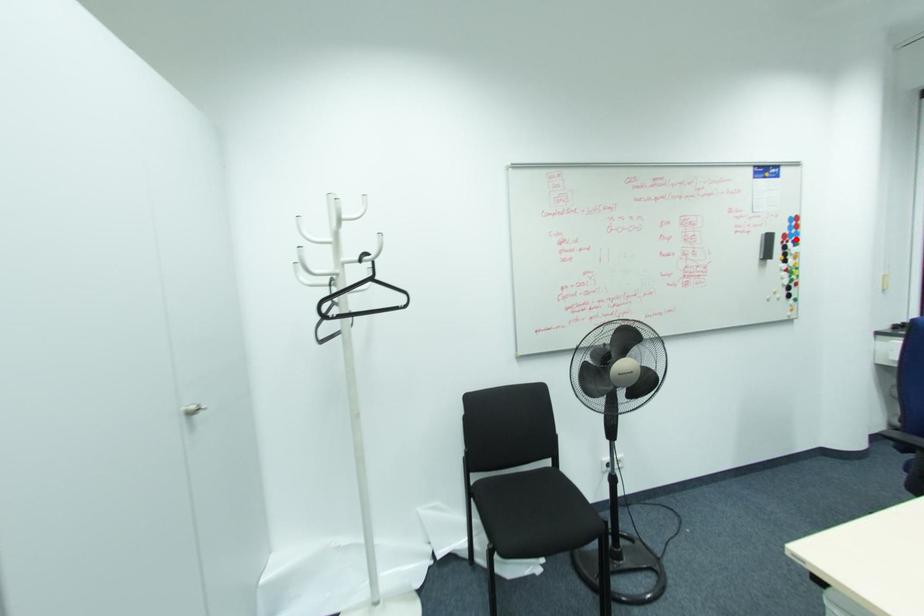
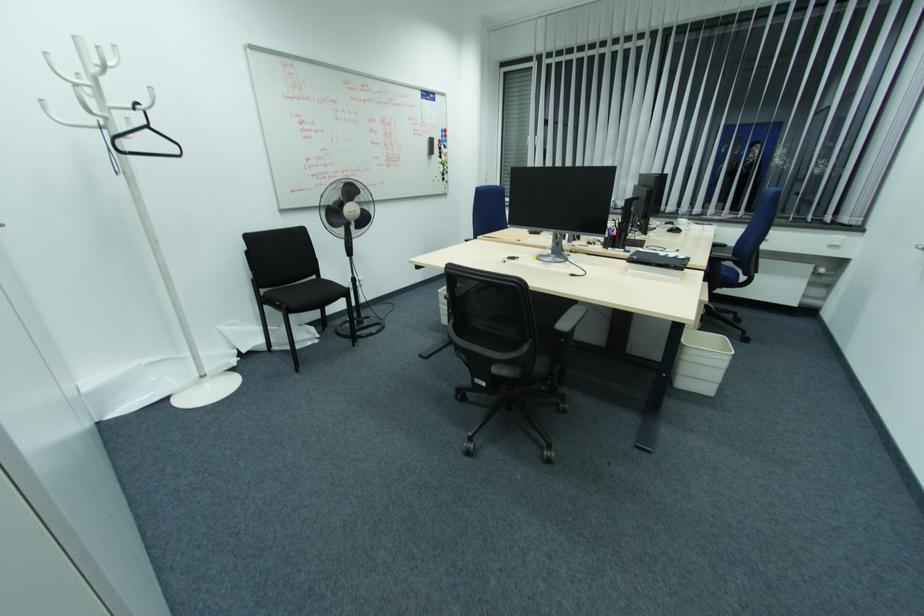
Question: I am providing you with two images of the same scene from different viewpoints. Given a red point in image1, look at the same physical point in image2. Is it:

Choices:
 (A) Closer to the viewpoint
 (B) Farther from the viewpoint

Answer: (A)